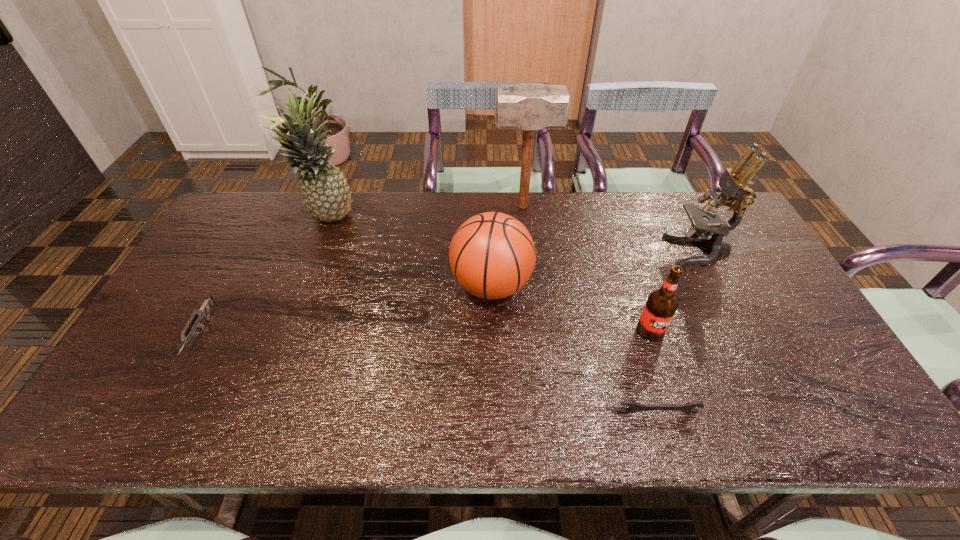
Locate an element on the screen. The height and width of the screenshot is (540, 960). free space located on the striking face of the mallet is located at coordinates (376, 207).

The width and height of the screenshot is (960, 540). What are the coordinates of `vacant space situated 0.380m on the striking face of the mallet` in the screenshot? It's located at (382, 207).

Find the location of `vacant space located 0.050m on the striking face of the mallet`. vacant space located 0.050m on the striking face of the mallet is located at coordinates (478, 207).

Locate an element on the screen. vacant space located 0.070m at the eyepieces of the microscope is located at coordinates (646, 252).

Where is `free space located 0.200m at the eyepieces of the microscope`? free space located 0.200m at the eyepieces of the microscope is located at coordinates (604, 252).

Where is `free space located at the eyepieces of the microscope`? The image size is (960, 540). free space located at the eyepieces of the microscope is located at coordinates (653, 252).

You are a GUI agent. You are given a task and a screenshot of the screen. Output one action in this format:
    pyautogui.click(x=<x>, y=<y>)
    Task: Click on the free location located 0.200m on the back of the basketball
    The image size is (960, 540).
    Given the screenshot: What is the action you would take?
    pyautogui.click(x=490, y=217)

Identify the location of vacant space located 0.320m on the back of the root beer. (620, 241).

I want to click on free space located aimed along the barrel of the second shortest object, so click(159, 409).

The height and width of the screenshot is (540, 960). Find the location of `pineapple positioned at the far edge`. pineapple positioned at the far edge is located at coordinates (326, 195).